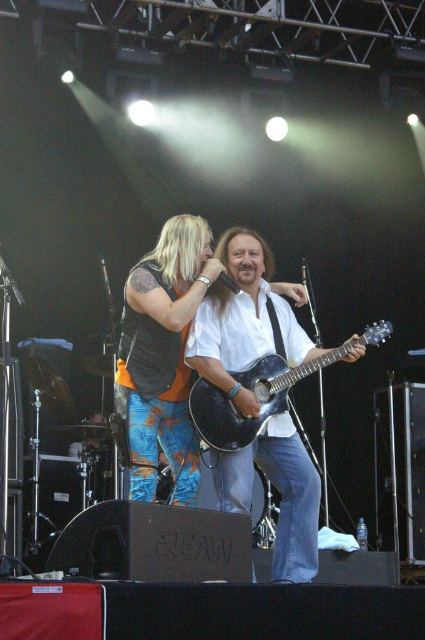
Question: Which of the following is the closest to the observer?

Choices:
 (A) shiny black guitar at center
 (B) orange printed pants at center
 (C) matte black acoustic guitar at center

Answer: (B)

Question: Which object appears closest to the camera in this image?

Choices:
 (A) shiny black guitar at center
 (B) orange printed pants at center
 (C) matte black acoustic guitar at center

Answer: (B)

Question: Can you confirm if orange printed pants at center is smaller than matte black acoustic guitar at center?

Choices:
 (A) yes
 (B) no

Answer: (B)

Question: Is shiny black guitar at center thinner than matte black acoustic guitar at center?

Choices:
 (A) yes
 (B) no

Answer: (A)

Question: Can you confirm if shiny black guitar at center is positioned above orange printed pants at center?

Choices:
 (A) yes
 (B) no

Answer: (B)

Question: Among these objects, which one is nearest to the camera?

Choices:
 (A) orange printed pants at center
 (B) shiny black guitar at center
 (C) matte black acoustic guitar at center

Answer: (A)